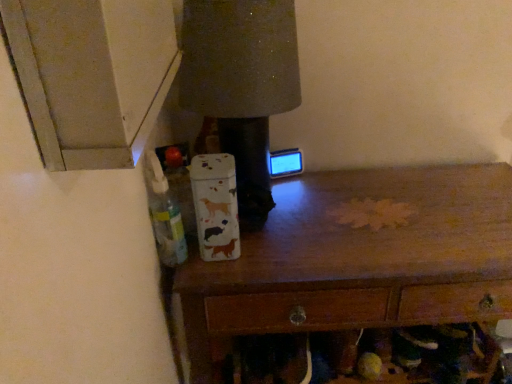
The height and width of the screenshot is (384, 512). What do you see at coordinates (358, 260) in the screenshot? I see `wooden chest of drawers at center` at bounding box center [358, 260].

Locate an element on the screen. This screenshot has width=512, height=384. wooden chest of drawers at center is located at coordinates (358, 260).

This screenshot has width=512, height=384. I want to click on translucent plastic bottle at left, so 165,214.

What do you see at coordinates (165, 214) in the screenshot?
I see `translucent plastic bottle at left` at bounding box center [165, 214].

I want to click on wooden chest of drawers at center, so click(358, 260).

Visually, is translucent plastic bottle at left positioned to the left or to the right of wooden chest of drawers at center?

translucent plastic bottle at left is to the left of wooden chest of drawers at center.

Is translucent plastic bottle at left in front of or behind wooden chest of drawers at center in the image?

Visually, translucent plastic bottle at left is located in front of wooden chest of drawers at center.

Between point (166, 189) and point (477, 268), which one is positioned behind?

The point (477, 268) is behind.

From the image's perspective, is translucent plastic bottle at left above or below wooden chest of drawers at center?

From the image's perspective, translucent plastic bottle at left appears above wooden chest of drawers at center.

From a real-world perspective, which is physically below, translucent plastic bottle at left or wooden chest of drawers at center?

wooden chest of drawers at center is physically lower.

Does translucent plastic bottle at left have a greater width compared to wooden chest of drawers at center?

In fact, translucent plastic bottle at left might be narrower than wooden chest of drawers at center.

Based on the photo, considering the sizes of translucent plastic bottle at left and wooden chest of drawers at center in the image, is translucent plastic bottle at left taller or shorter than wooden chest of drawers at center?

Considering their sizes, translucent plastic bottle at left has less height than wooden chest of drawers at center.

Can you confirm if translucent plastic bottle at left is smaller than wooden chest of drawers at center?

Yes.

Is translucent plastic bottle at left positioned beyond the bounds of wooden chest of drawers at center?

Absolutely, translucent plastic bottle at left is external to wooden chest of drawers at center.

Are translucent plastic bottle at left and wooden chest of drawers at center located far from each other?

translucent plastic bottle at left is near wooden chest of drawers at center, not far away.

Does translucent plastic bottle at left turn towards wooden chest of drawers at center?

No, translucent plastic bottle at left is not aimed at wooden chest of drawers at center.

In the scene shown: How many degrees apart are the facing directions of translucent plastic bottle at left and wooden chest of drawers at center?

90 degrees separate the facing orientations of translucent plastic bottle at left and wooden chest of drawers at center.

I want to click on bottle on the left of wooden chest of drawers at center, so click(x=165, y=214).

Is wooden chest of drawers at center at the left side of translucent plastic bottle at left?

Incorrect, wooden chest of drawers at center is not on the left side of translucent plastic bottle at left.

Which is in front, wooden chest of drawers at center or translucent plastic bottle at left?

translucent plastic bottle at left.

Which is in front, point (250, 269) or point (163, 208)?

The point (163, 208) is more forward.

From the image's perspective, which object appears higher, wooden chest of drawers at center or translucent plastic bottle at left?

translucent plastic bottle at left.

From a real-world perspective, is wooden chest of drawers at center physically located above or below translucent plastic bottle at left?

wooden chest of drawers at center is situated lower than translucent plastic bottle at left in the real world.

Which of these two, wooden chest of drawers at center or translucent plastic bottle at left, is wider?

wooden chest of drawers at center is wider.

Which of these two, wooden chest of drawers at center or translucent plastic bottle at left, stands shorter?

Standing shorter between the two is translucent plastic bottle at left.

Considering the sizes of objects wooden chest of drawers at center and translucent plastic bottle at left in the image provided, who is bigger, wooden chest of drawers at center or translucent plastic bottle at left?

wooden chest of drawers at center is bigger.

Is wooden chest of drawers at center spatially inside translucent plastic bottle at left, or outside of it?

wooden chest of drawers at center lies outside translucent plastic bottle at left.

Is wooden chest of drawers at center far from translucent plastic bottle at left?

No.

Is wooden chest of drawers at center oriented away from translucent plastic bottle at left?

wooden chest of drawers at center does not have its back to translucent plastic bottle at left.

Where is `bottle in front of the wooden chest of drawers at center`? This screenshot has height=384, width=512. bottle in front of the wooden chest of drawers at center is located at coordinates (165, 214).

Where is `the chest of drawers located underneath the translucent plastic bottle at left (from a real-world perspective)`? This screenshot has height=384, width=512. the chest of drawers located underneath the translucent plastic bottle at left (from a real-world perspective) is located at coordinates (358, 260).

The image size is (512, 384). I want to click on bottle above the wooden chest of drawers at center (from the image's perspective), so click(165, 214).